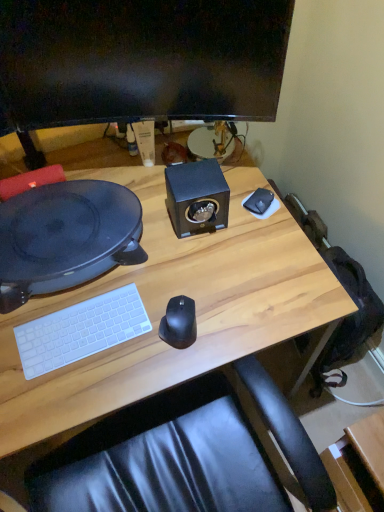
Image resolution: width=384 pixels, height=512 pixels. Find the location of `vacant space that is in between black matte mouse at center and black matte speaker at center`. vacant space that is in between black matte mouse at center and black matte speaker at center is located at coordinates (191, 268).